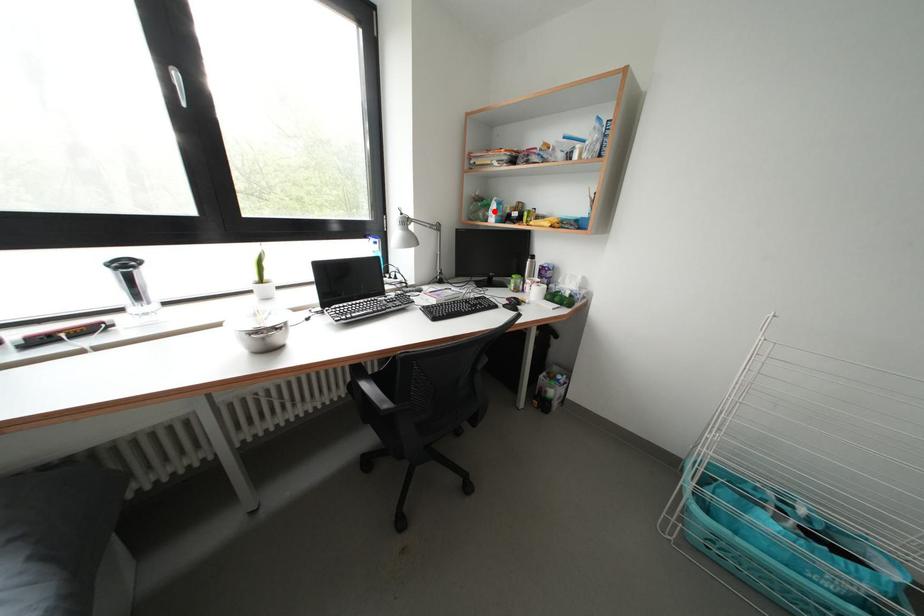
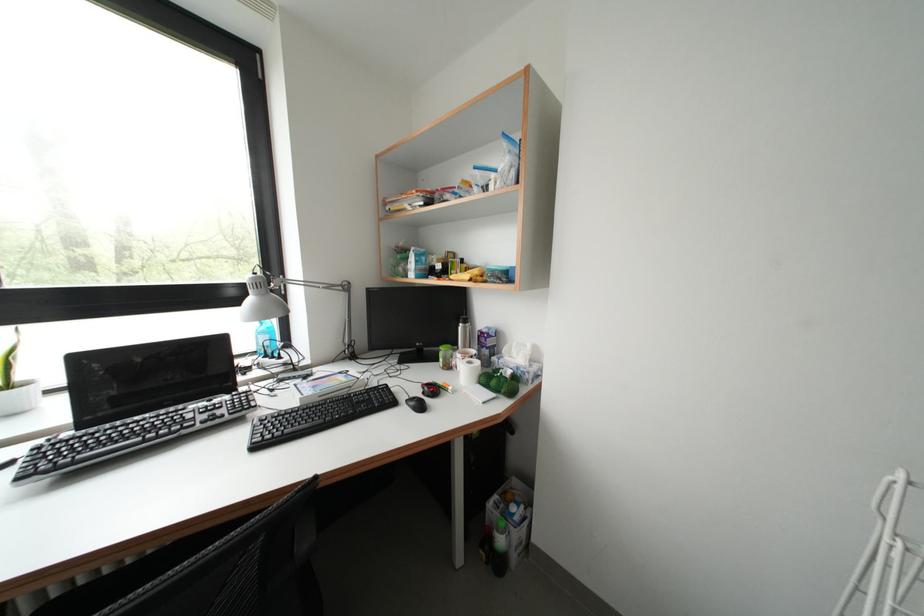
The point at the highlighted location is marked in the first image. Where is the corresponding point in the second image?

(415, 264)